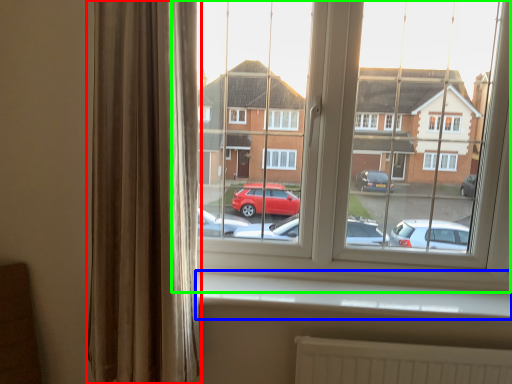
Question: Estimate the real-world distances between objects in this image. Which object is farther from curtain (highlighted by a red box), window sill (highlighted by a blue box) or window (highlighted by a green box)?

Choices:
 (A) window sill
 (B) window

Answer: (B)